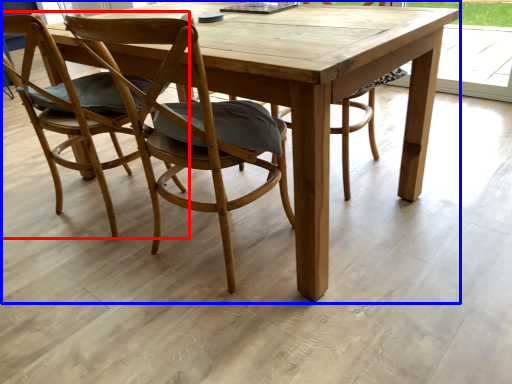
Question: Which object appears farthest to the camera in this image, chair (highlighted by a red box) or picnic table (highlighted by a blue box)?

Choices:
 (A) chair
 (B) picnic table

Answer: (A)